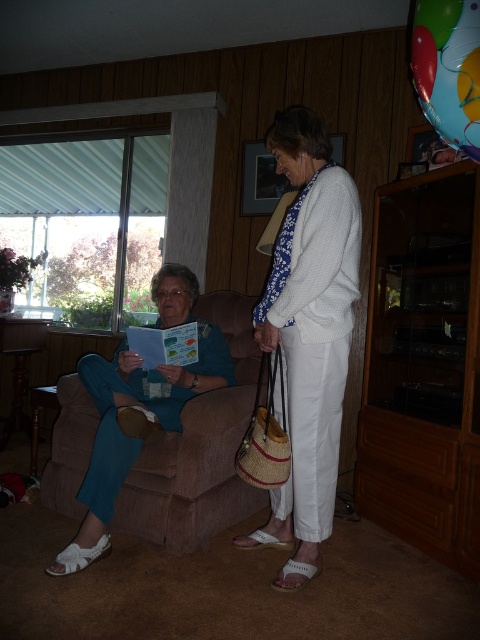
Consider the image. You are a delivery person who needs to place a small package between the white woven purse at center and the translucent plastic balloon at upper right. Can you fit it there?

The distance between the white woven purse at center and the translucent plastic balloon at upper right is 26.51 inches, so yes, the small package can fit there.

In the scene shown: You are a guest at a party and need to locate your white woven purse at center and the translucent plastic balloon at upper right. According to the scene, which object is closer to the window on the left?

The white woven purse at center is to the left of the translucent plastic balloon at upper right, so the white woven purse at center is closer to the window on the left.

You are standing in the living room and want to take a photo of the point at coordinates (328, 189). Is the point within your camera frame if your camera has a focal length of 50mm and a sensor size of 24mm x 36mm?

The point at coordinates (328, 189) is 1.75 meters from the camera. To determine if it is within the frame, calculate the camera field of view. With a 50mm lens and 24mm sensor height, the vertical FOV is approximately 27 degrees. The distance to the point is 1.75m. Using trigonometry, the maximum vertical coverage is tan 13.5 degrees multiplied by 1.75m, which is about 0.41 meters. Since the point is at coordinate 0.298 on the vertical axis, it lies within the camera frame.